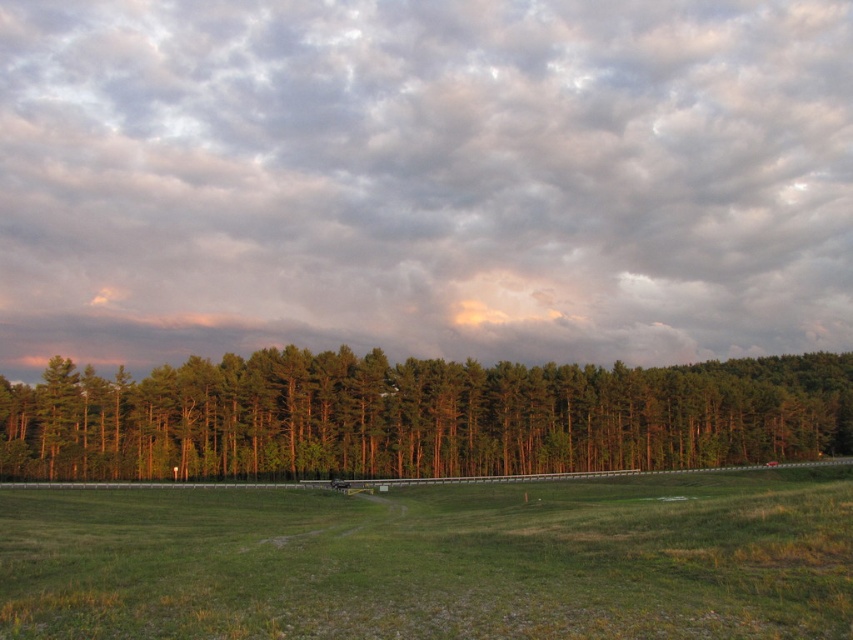
Question: Which object is farther from the camera taking this photo?

Choices:
 (A) cloudy sky at upper center
 (B) green grass at center

Answer: (A)

Question: Does cloudy sky at upper center appear on the left side of green grass at center?

Choices:
 (A) no
 (B) yes

Answer: (A)

Question: Which of the following is the farthest from the observer?

Choices:
 (A) (566, 440)
 (B) (718, 132)

Answer: (B)

Question: Does cloudy sky at upper center come in front of green grass at center?

Choices:
 (A) no
 (B) yes

Answer: (A)

Question: Can you confirm if cloudy sky at upper center is wider than green matte trees at center?

Choices:
 (A) no
 (B) yes

Answer: (B)

Question: Among these objects, which one is nearest to the camera?

Choices:
 (A) green matte trees at center
 (B) cloudy sky at upper center
 (C) green grass at center

Answer: (C)